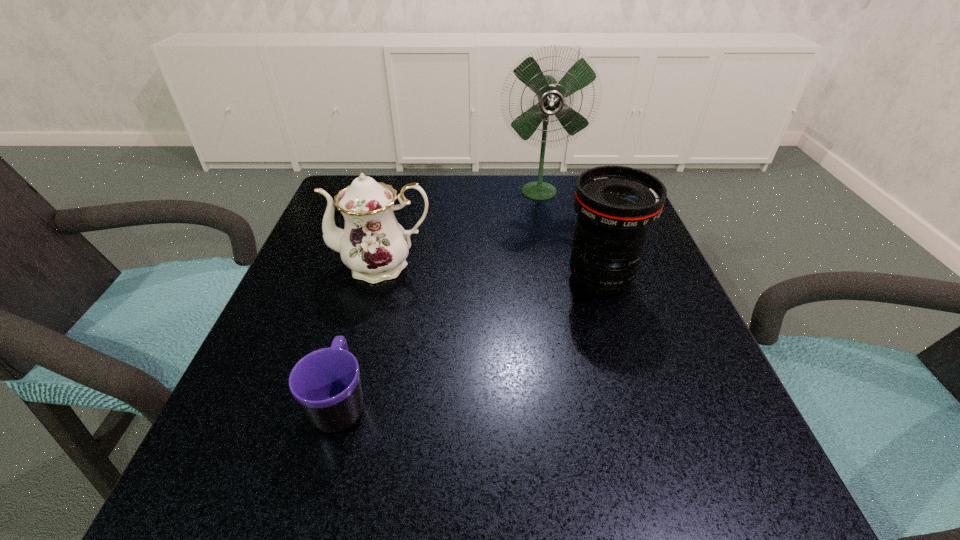
Where is `fan`? The width and height of the screenshot is (960, 540). fan is located at coordinates (551, 94).

Where is `the tallest object`? the tallest object is located at coordinates (551, 94).

This screenshot has width=960, height=540. In order to click on chinaware in this screenshot , I will do [x=373, y=244].

Locate an element on the screen. Image resolution: width=960 pixels, height=540 pixels. telephoto lens is located at coordinates (616, 205).

Where is `mug`? mug is located at coordinates (326, 383).

This screenshot has width=960, height=540. What are the coordinates of `the nearest object` in the screenshot? It's located at (326, 383).

Where is `blank area located 0.090m on the front-facing side of the farthest object`? blank area located 0.090m on the front-facing side of the farthest object is located at coordinates (545, 226).

Identify the location of free space located on the front of the chinaware. (371, 311).

Identify the location of free space located on the left of the telephoto lens. This screenshot has height=540, width=960. (475, 279).

You are a GUI agent. You are given a task and a screenshot of the screen. Output one action in this format:
    pyautogui.click(x=<x>, y=<y>)
    Task: Click on the vacant region located 0.070m with the handle on the side of the mug
    
    Given the screenshot: What is the action you would take?
    tap(360, 334)